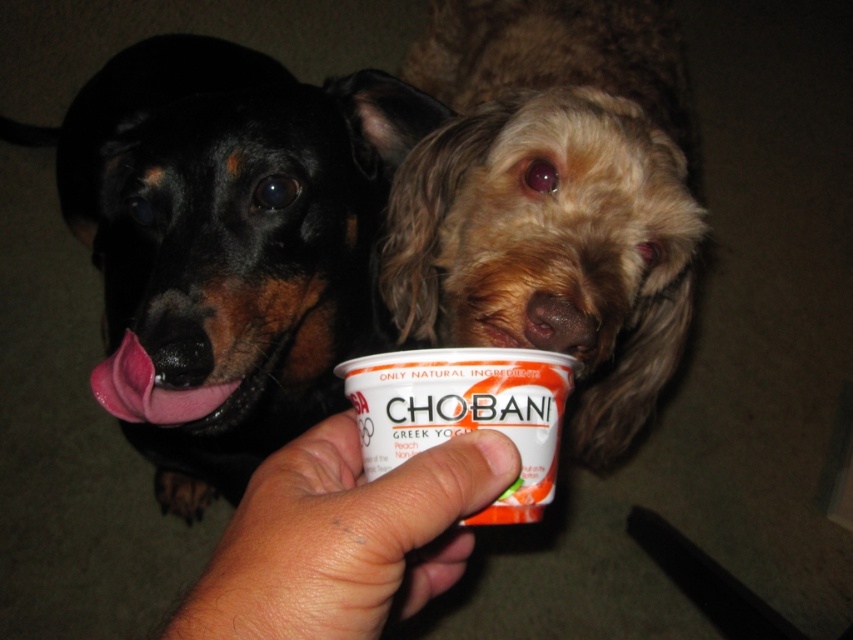
Question: Which of these objects is positioned closest to the black glossy fur at left?

Choices:
 (A) shaggy brown fur at center
 (B) smooth skin hand at center

Answer: (A)

Question: In this image, where is shaggy brown fur at center located relative to smooth skin hand at center?

Choices:
 (A) left
 (B) right

Answer: (B)

Question: Where is shaggy brown fur at center located in relation to smooth skin hand at center in the image?

Choices:
 (A) right
 (B) left

Answer: (A)

Question: Considering the relative positions of black glossy fur at left and shaggy brown fur at center in the image provided, where is black glossy fur at left located with respect to shaggy brown fur at center?

Choices:
 (A) above
 (B) below

Answer: (A)

Question: Estimate the real-world distances between objects in this image. Which object is closer to the black glossy fur at left?

Choices:
 (A) shaggy brown fur at center
 (B) smooth skin hand at center

Answer: (A)

Question: Which point appears farthest from the camera in this image?

Choices:
 (A) (625, 22)
 (B) (202, 621)

Answer: (A)